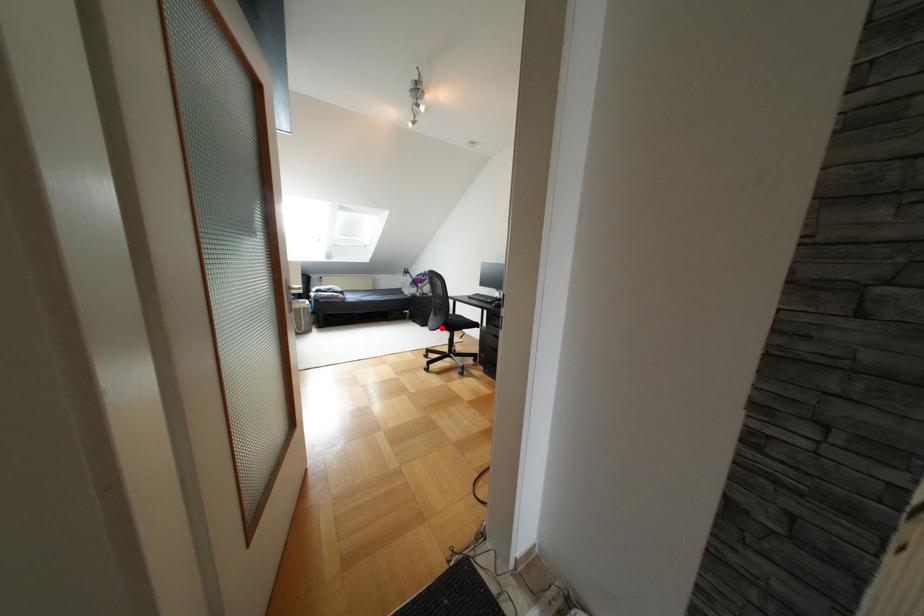
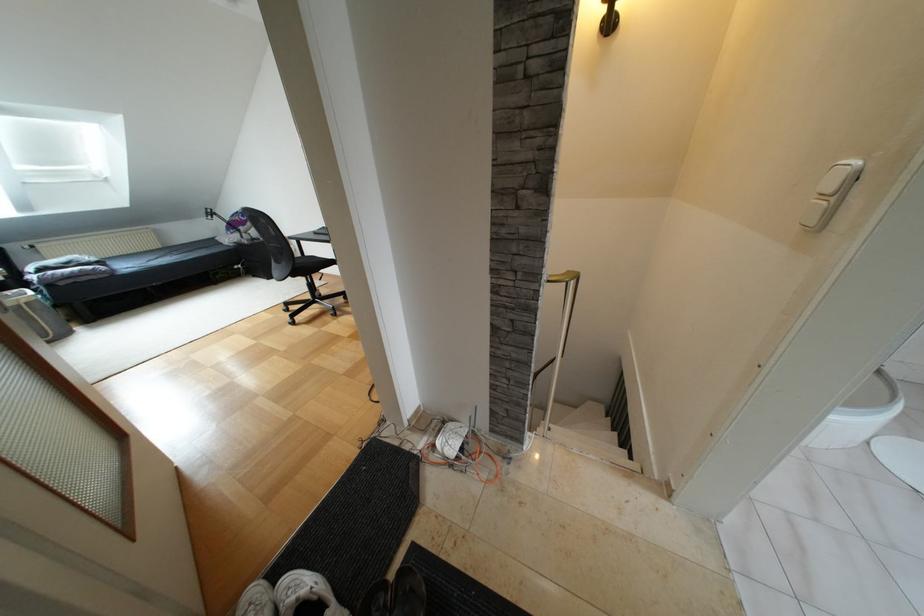
In the second image, find the point that corresponds to the highlighted location in the first image.

(293, 275)